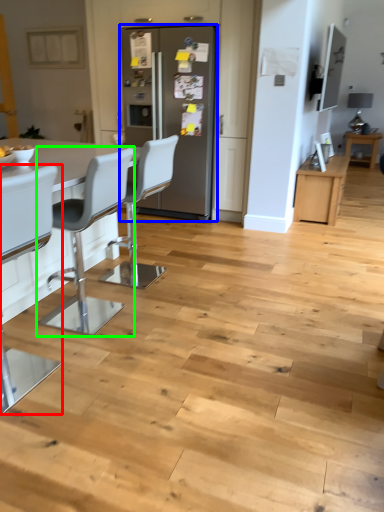
Question: Which is farther away from chair (highlighted by a red box)? fridge (highlighted by a blue box) or chair (highlighted by a green box)?

Choices:
 (A) fridge
 (B) chair

Answer: (A)